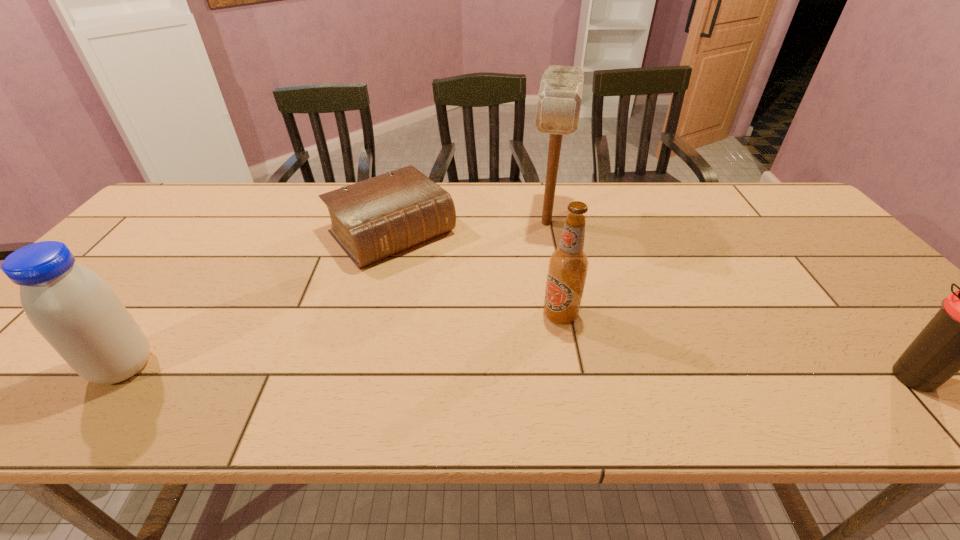
The image size is (960, 540). In order to click on soya milk present at the near edge in this screenshot , I will do `click(75, 310)`.

Locate an element on the screen. The image size is (960, 540). thermos bottle present at the near edge is located at coordinates (959, 337).

Where is `object at the right edge`? The width and height of the screenshot is (960, 540). object at the right edge is located at coordinates (959, 337).

Locate an element on the screen. Image resolution: width=960 pixels, height=540 pixels. object that is at the near right corner is located at coordinates (959, 337).

This screenshot has width=960, height=540. In order to click on vacant space at the far edge of the desktop in this screenshot , I will do `click(631, 208)`.

Locate an element on the screen. vacant space at the near edge of the desktop is located at coordinates (297, 371).

The height and width of the screenshot is (540, 960). Find the location of `free region at the left edge of the desktop`. free region at the left edge of the desktop is located at coordinates (144, 237).

At what (x,y) coordinates should I click in order to perform the action: click on free region at the right edge of the desktop. Please return your answer as a coordinate pair (x, y). The width and height of the screenshot is (960, 540). Looking at the image, I should click on (885, 301).

Where is `vacant space at the far right corner`? This screenshot has width=960, height=540. vacant space at the far right corner is located at coordinates (766, 195).

Where is `empty space between the tallest object and the thermos bottle`? empty space between the tallest object and the thermos bottle is located at coordinates (730, 300).